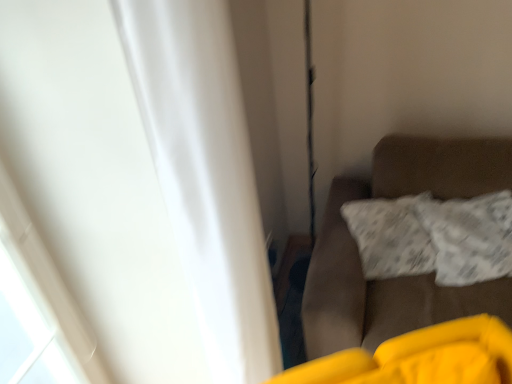
Question: Is white textured pillow at right at the left side of white matte curtain at left?

Choices:
 (A) no
 (B) yes

Answer: (A)

Question: Does white textured pillow at right come behind white matte curtain at left?

Choices:
 (A) no
 (B) yes

Answer: (B)

Question: Would you say white textured pillow at right contains white matte curtain at left?

Choices:
 (A) yes
 (B) no

Answer: (B)

Question: Considering the relative positions of white textured pillow at right and white matte curtain at left in the image provided, is white textured pillow at right in front of white matte curtain at left?

Choices:
 (A) yes
 (B) no

Answer: (B)

Question: Considering the relative positions of white textured pillow at right and white matte curtain at left in the image provided, is white textured pillow at right to the right of white matte curtain at left from the viewer's perspective?

Choices:
 (A) yes
 (B) no

Answer: (A)

Question: Does white textured pillow at right have a larger size compared to white matte curtain at left?

Choices:
 (A) yes
 (B) no

Answer: (B)

Question: Can brown fabric couch at right be found inside white textured pillow at right?

Choices:
 (A) no
 (B) yes

Answer: (A)

Question: Considering the relative positions of white textured pillow at right and brown fabric couch at right in the image provided, is white textured pillow at right behind brown fabric couch at right?

Choices:
 (A) no
 (B) yes

Answer: (B)

Question: From the image's perspective, is white textured pillow at right located beneath brown fabric couch at right?

Choices:
 (A) yes
 (B) no

Answer: (B)

Question: Is white textured pillow at right at the left side of brown fabric couch at right?

Choices:
 (A) no
 (B) yes

Answer: (A)

Question: Considering the relative sizes of white textured pillow at right and brown fabric couch at right in the image provided, is white textured pillow at right wider than brown fabric couch at right?

Choices:
 (A) no
 (B) yes

Answer: (A)

Question: Is white textured pillow at right oriented away from brown fabric couch at right?

Choices:
 (A) no
 (B) yes

Answer: (B)

Question: Is white matte curtain at left completely or partially outside of brown fabric couch at right?

Choices:
 (A) yes
 (B) no

Answer: (A)